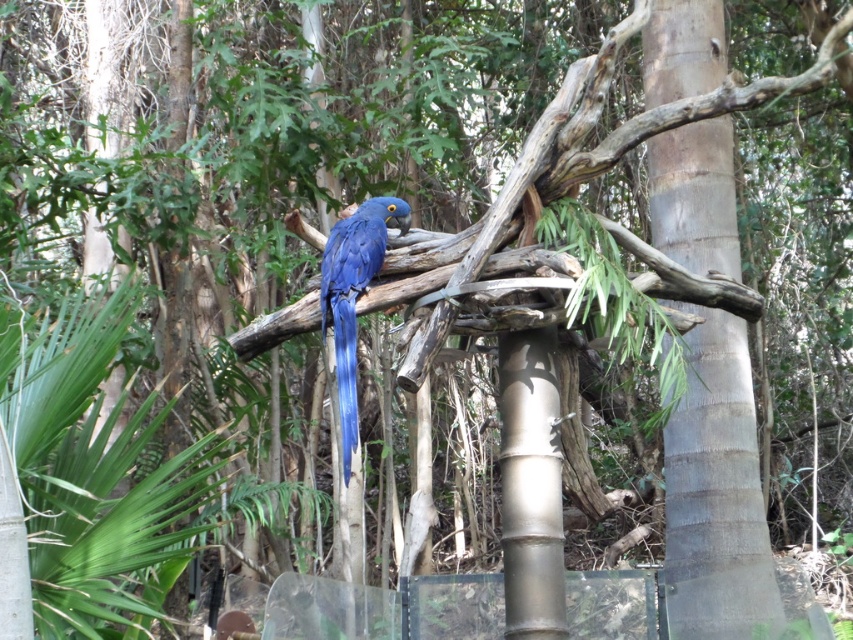
Question: From the image, what is the correct spatial relationship of smooth gray tree trunk at center in relation to blue glossy parrot at center?

Choices:
 (A) below
 (B) above

Answer: (A)

Question: Among these points, which one is nearest to the camera?

Choices:
 (A) (544, 604)
 (B) (672, 433)

Answer: (A)

Question: Which object appears farthest from the camera in this image?

Choices:
 (A) blue glossy parrot at center
 (B) brushed metal pole at center
 (C) smooth gray tree trunk at center

Answer: (C)

Question: Can you confirm if smooth gray tree trunk at center is wider than blue glossy parrot at center?

Choices:
 (A) no
 (B) yes

Answer: (B)

Question: Among these points, which one is farthest from the camera?

Choices:
 (A) (518, 620)
 (B) (672, 136)
 (C) (338, 243)

Answer: (B)

Question: Observing the image, what is the correct spatial positioning of brushed metal pole at center in reference to blue glossy parrot at center?

Choices:
 (A) above
 (B) below

Answer: (B)